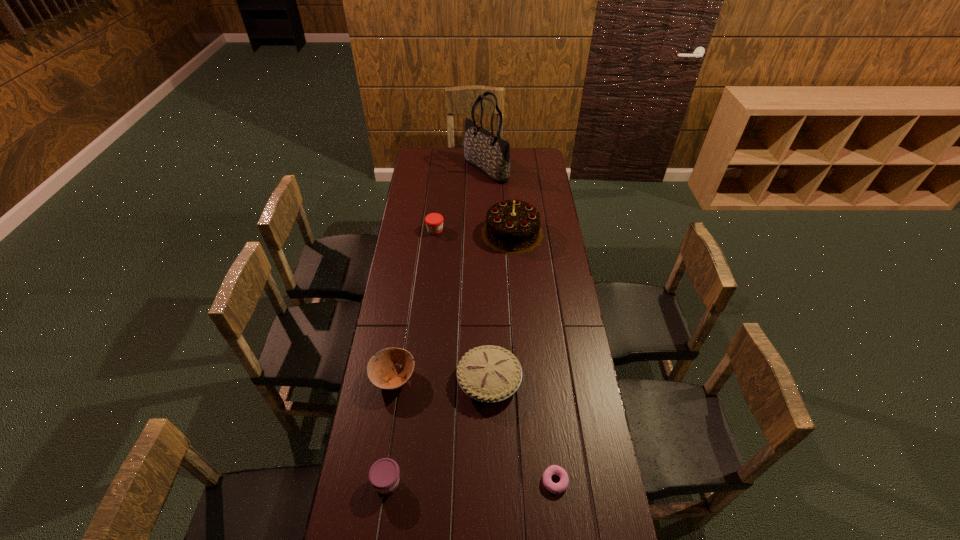
Image resolution: width=960 pixels, height=540 pixels. I want to click on the farthest object, so click(x=485, y=151).

Find the location of `the tallest object`. the tallest object is located at coordinates (485, 151).

Where is `birthday cake`? The height and width of the screenshot is (540, 960). birthday cake is located at coordinates (512, 227).

Locate an element on the screen. pie is located at coordinates (489, 373).

You are a GUI agent. You are given a task and a screenshot of the screen. Output one action in this format:
    pyautogui.click(x=<x>, y=<y>)
    Task: Click on the bowl
    The width and height of the screenshot is (960, 540).
    Given the screenshot: What is the action you would take?
    pyautogui.click(x=380, y=373)

Locate an element on the screen. the farther jam is located at coordinates (434, 221).

Where is `the nearer jam`? The width and height of the screenshot is (960, 540). the nearer jam is located at coordinates (383, 475).

The width and height of the screenshot is (960, 540). What are the coordinates of `pastry` in the screenshot? It's located at (561, 486).

Where is `free spot located 0.310m on the left of the tallest object`? This screenshot has height=540, width=960. free spot located 0.310m on the left of the tallest object is located at coordinates (x=411, y=170).

The image size is (960, 540). Identify the location of vacant region located 0.130m on the front of the second tallest object. (516, 274).